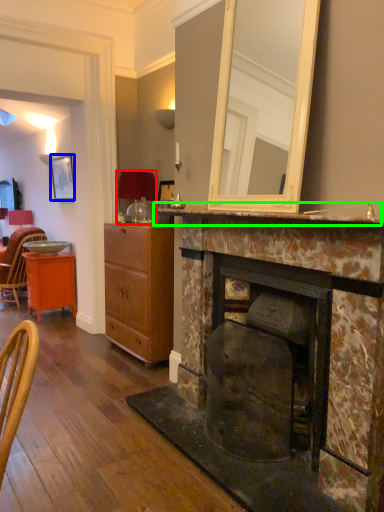
Question: Which object is the closest to the lamp (highlighted by a red box)? Choose among these: picture frame (highlighted by a blue box) or mantle (highlighted by a green box).

Choices:
 (A) picture frame
 (B) mantle

Answer: (A)